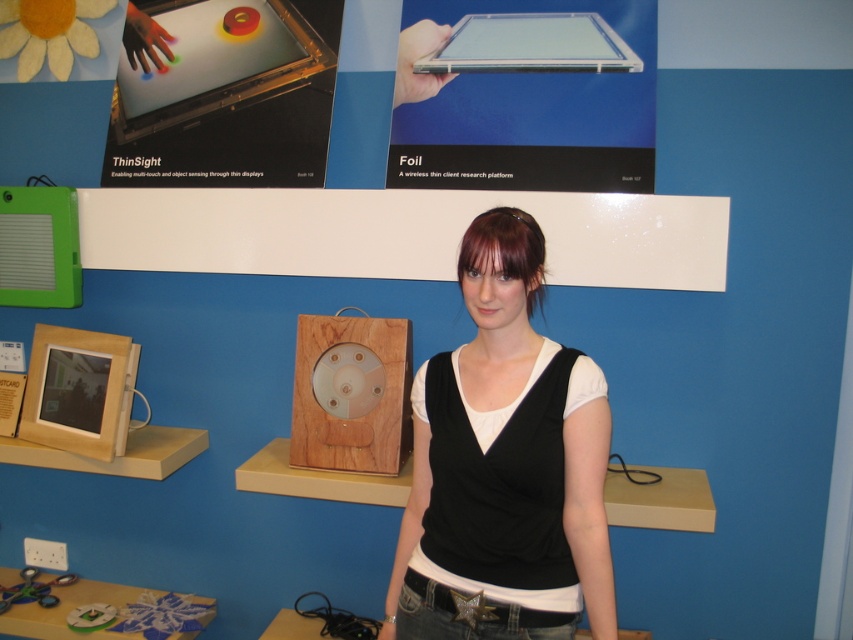
Question: Can you confirm if black matte tank top at center is thinner than wooden clock at center?

Choices:
 (A) no
 (B) yes

Answer: (A)

Question: Among these objects, which one is nearest to the camera?

Choices:
 (A) black matte tank top at center
 (B) wooden clock at center

Answer: (A)

Question: Observing the image, what is the correct spatial positioning of black matte tank top at center in reference to wooden clock at center?

Choices:
 (A) below
 (B) above

Answer: (A)

Question: Does black matte tank top at center appear on the left side of wooden clock at center?

Choices:
 (A) yes
 (B) no

Answer: (B)